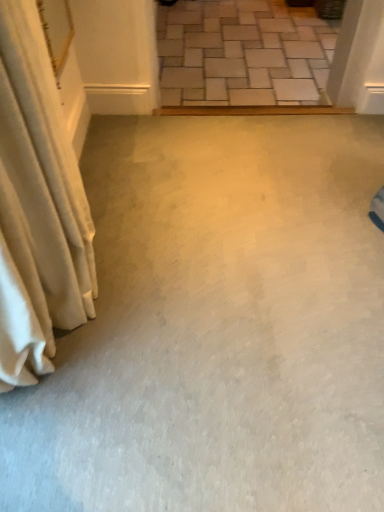
This screenshot has height=512, width=384. Identify the location of free space to the back side of white fabric curtain at left. (140, 198).